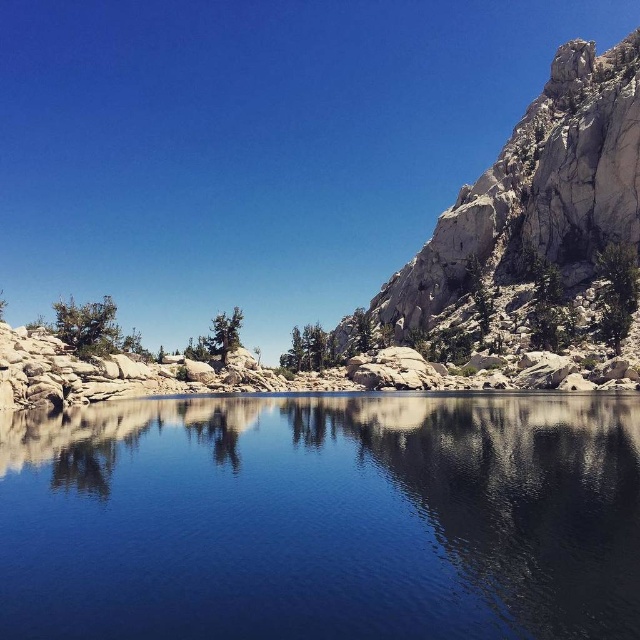
Question: Is transparent glass water at center to the right of rugged stone mountain at right from the viewer's perspective?

Choices:
 (A) no
 (B) yes

Answer: (A)

Question: Which point is closer to the camera?

Choices:
 (A) rugged stone mountain at right
 (B) transparent glass water at center

Answer: (B)

Question: Does transparent glass water at center lie in front of rugged stone mountain at right?

Choices:
 (A) no
 (B) yes

Answer: (B)

Question: Among these points, which one is farthest from the camera?

Choices:
 (A) (506, 268)
 (B) (385, 595)

Answer: (A)

Question: Where is transparent glass water at center located in relation to rugged stone mountain at right in the image?

Choices:
 (A) right
 (B) left

Answer: (B)